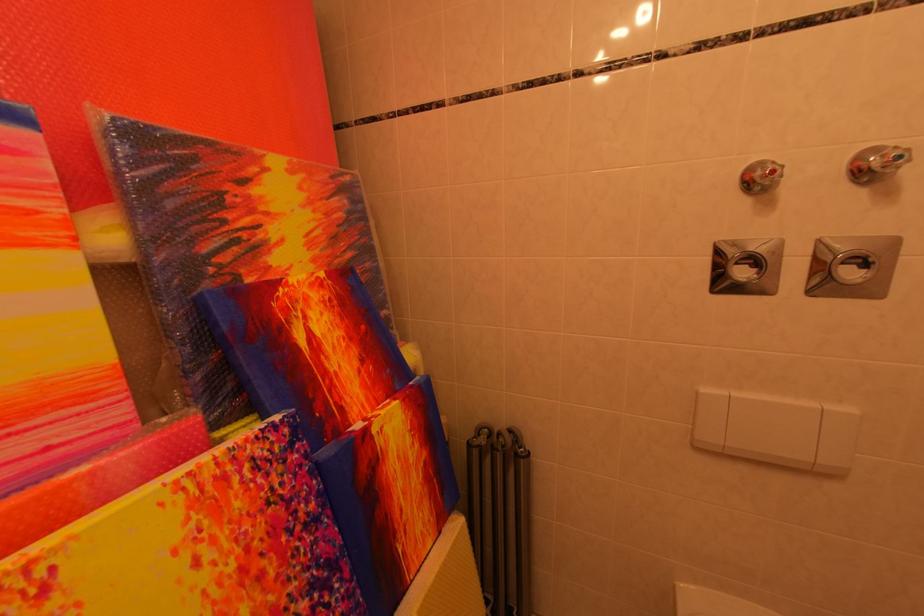
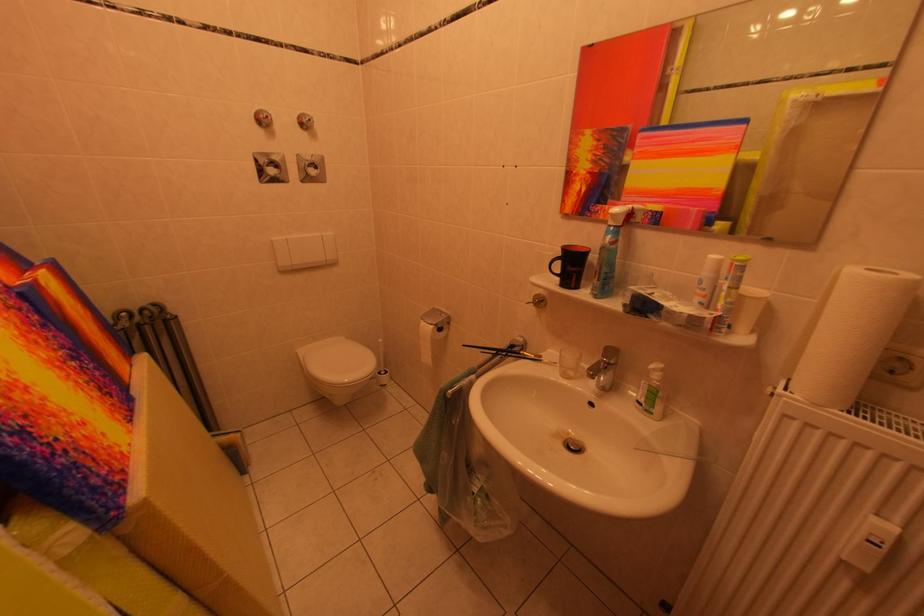
The point at [751,277] is marked in the first image. Where is the corresponding point in the second image?

(282, 175)